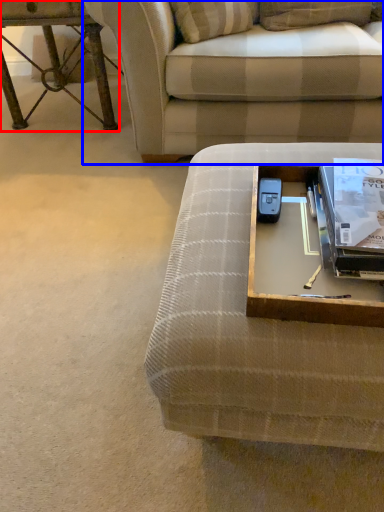
Question: Which point is further to the camera, table (highlighted by a red box) or studio couch (highlighted by a blue box)?

Choices:
 (A) table
 (B) studio couch

Answer: (A)